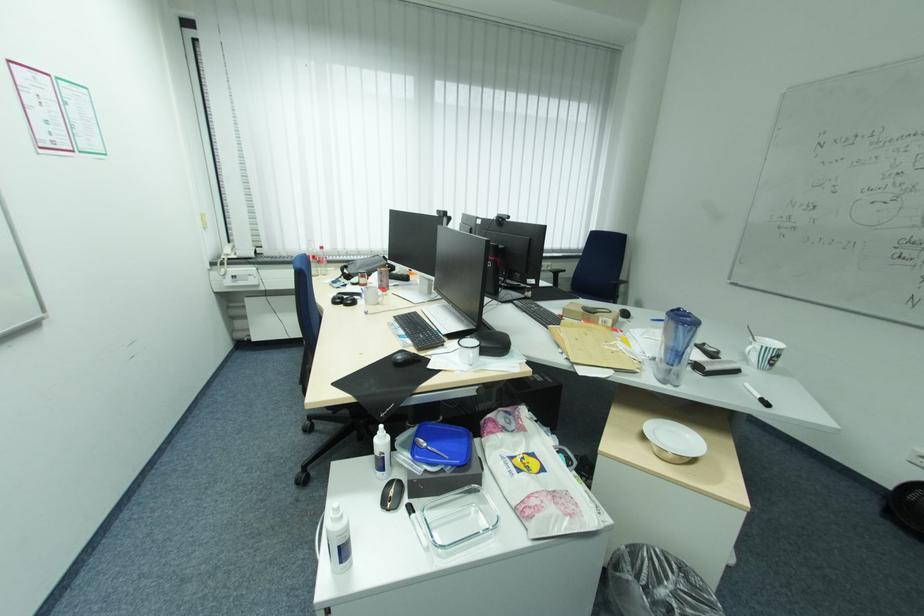
Find where to lift the blue plastic lid. Please return your answer as a coordinate pair (x, y).

(441, 445)